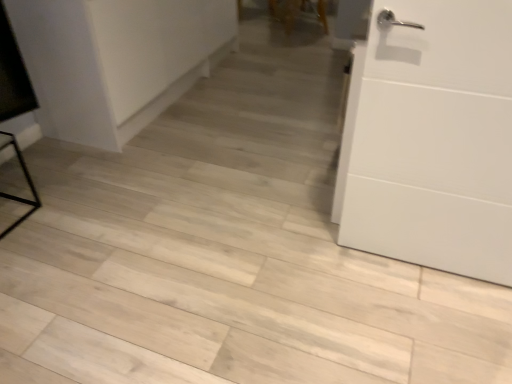
Image resolution: width=512 pixels, height=384 pixels. Identify the location of vacant area situated below white matte door at right (from a real-world perspective). (416, 264).